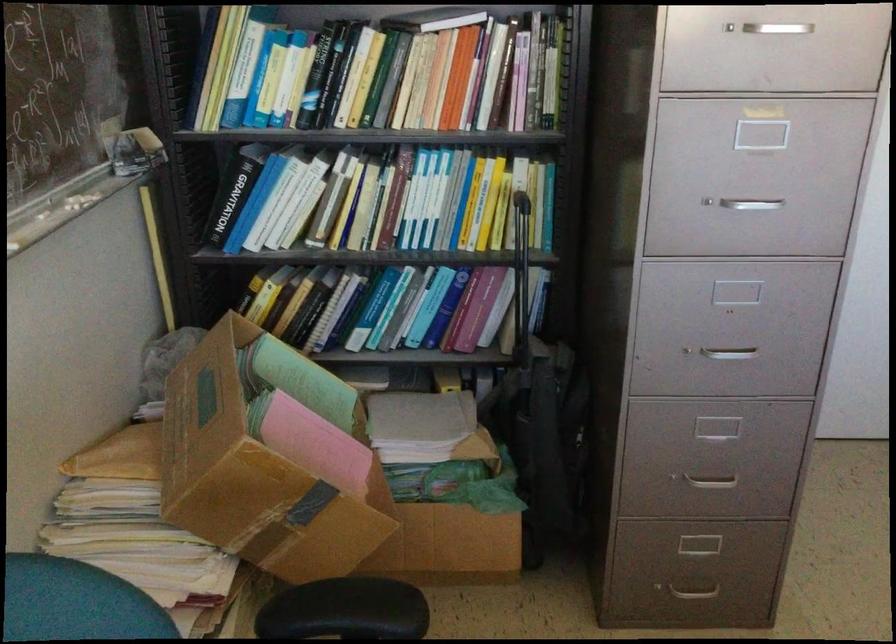
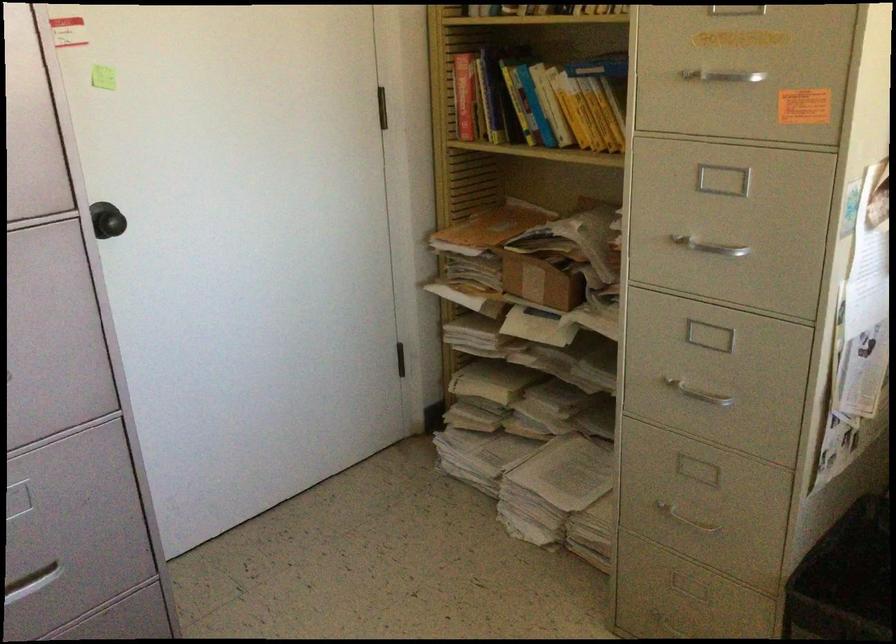
Question: The camera is either moving clockwise (left) or counter-clockwise (right) around the object. The first image is from the beginning of the video and the second image is from the end. Is the camera moving left or right when shooting the video?

Choices:
 (A) Left
 (B) Right

Answer: (A)